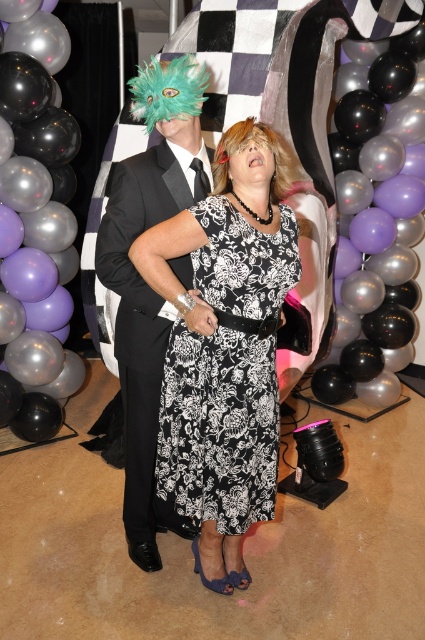
You are a photographer at the event and want to ensure proper spacing between the two guests for a group photo. The minimum recommended distance between guests is 1.8 meters for safety. Can the two guests at positions point (278,301) and the other person be safely positioned without violating the safety guidelines?

The two guests at positions point (278,301) are 1.91 meters apart, which exceeds the minimum recommended distance of 1.8 meters. Therefore, they can be safely positioned without violating the safety guidelines.

You are a photographer at the event and need to adjust the lighting so that the black glossy balloon at center doesn not cast a shadow over the black floral dress at center. Given their relative heights, which one should you position closer to the light source?

The black floral dress at center is not as tall as the black glossy balloon at center, so to prevent the balloon from casting a shadow on the dress, you should position the black glossy balloon at center closer to the light source.

You are organizing a party and need to ensure that all decorations are within a 1.2 meter safety distance from guests. Given the scene described, is the black glossy balloon at center positioned safely relative to the matte black suit at center?

The distance between the black glossy balloon at center and the matte black suit at center is 1.12 meters, which is within the 1.2 meter safety requirement. Therefore, the balloon is positioned safely.